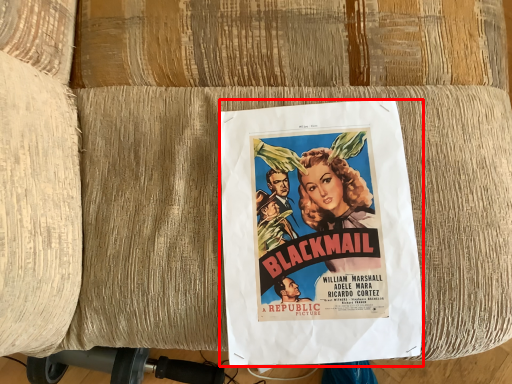
Question: From the image, what is the correct spatial relationship of poster (annotated by the red box) in relation to vacuum?

Choices:
 (A) right
 (B) left

Answer: (A)